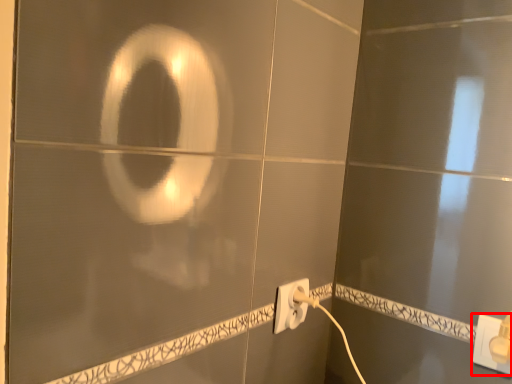
Question: In this image, where is power plugs and sockets (annotated by the red box) located relative to power plugs and sockets?

Choices:
 (A) left
 (B) right

Answer: (B)